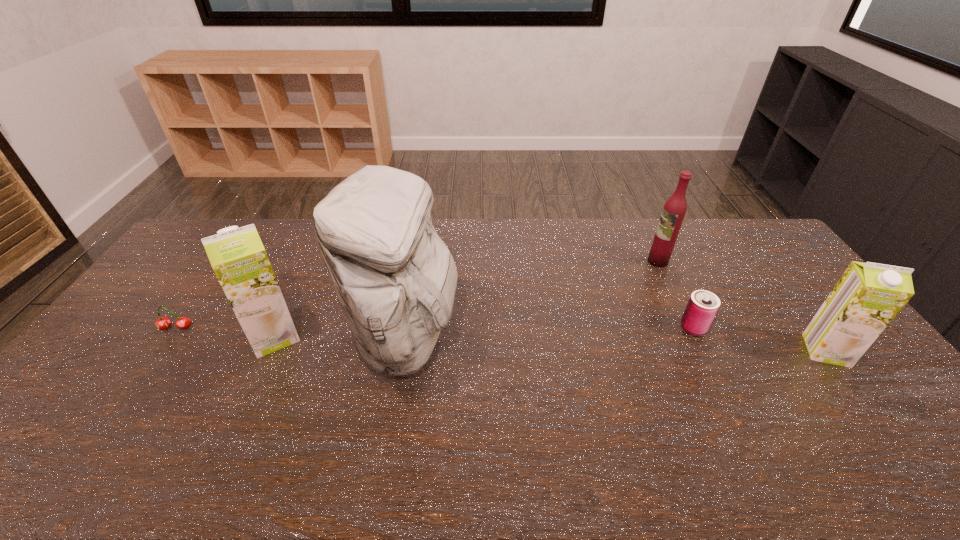
What are the coordinates of `vacant position for inserting another soya_milk evenly` in the screenshot? It's located at (545, 343).